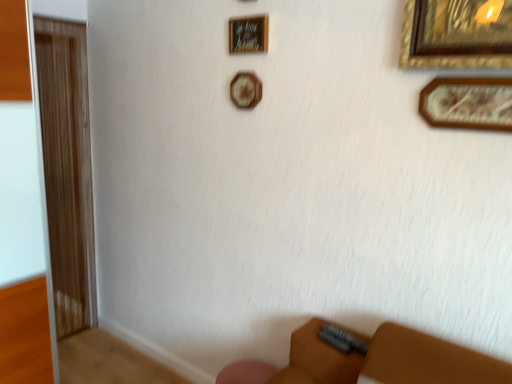
Measure the distance between wooden picture frame at upper center, arranged as the 2th picture frame when viewed from the top, and camera.

The depth of wooden picture frame at upper center, arranged as the 2th picture frame when viewed from the top, is 6.03 feet.

Describe the element at coordinates (67, 169) in the screenshot. The width and height of the screenshot is (512, 384). I see `brown wood screen door at left` at that location.

Describe the element at coordinates (248, 34) in the screenshot. I see `wooden plaque at upper center, which is the 2th picture frame in right-to-left order` at that location.

Locate an element on the screen. The height and width of the screenshot is (384, 512). wooden picture frame at upper right, acting as the 3th picture frame starting from the top is located at coordinates (468, 103).

Is wooden picture frame at upper center, which is counted as the second picture frame, starting from the bottom, wider or thinner than wooden plaque at upper center, which is the 2th picture frame in right-to-left order?

In the image, wooden picture frame at upper center, which is counted as the second picture frame, starting from the bottom, appears to be wider than wooden plaque at upper center, which is the 2th picture frame in right-to-left order.

Between wooden picture frame at upper center, which is the 3th picture frame from right to left, and wooden plaque at upper center, which is the 2th picture frame in right-to-left order, which one is positioned in front?

wooden plaque at upper center, which is the 2th picture frame in right-to-left order, is in front.

From the image's perspective, is wooden picture frame at upper center, which is counted as the first picture frame, starting from the left, beneath wooden plaque at upper center, the 2th picture frame in the back-to-front sequence?

Yes.

From a real-world perspective, which object stands above the other?

In real-world perspective, wooden plaque at upper center, the 2th picture frame in the back-to-front sequence, is above.

Is wooden picture frame at upper right, which is the third picture frame from back to front, turned away from wooden plaque at upper center, which is the 2th picture frame in right-to-left order?

wooden picture frame at upper right, which is the third picture frame from back to front, is not turned away from wooden plaque at upper center, which is the 2th picture frame in right-to-left order.

Is wooden picture frame at upper right, which is the third picture frame from back to front, completely or partially outside of wooden plaque at upper center, which appears as the 1th picture frame when viewed from the top?

Yes.

Is wooden picture frame at upper right, the 1th picture frame when ordered from right to left, to the right of wooden plaque at upper center, which is the 2th picture frame in right-to-left order, from the viewer's perspective?

Yes, wooden picture frame at upper right, the 1th picture frame when ordered from right to left, is to the right of wooden plaque at upper center, which is the 2th picture frame in right-to-left order.

Identify the location of picture frame that is the 2nd one below the wooden plaque at upper center, which appears as the 1th picture frame when viewed from the top (from a real-world perspective). (468, 103).

How many degrees apart are the facing directions of wooden picture frame at upper right, the 3th picture frame when ordered from left to right, and wooden picture frame at upper center, arranged as the 2th picture frame when viewed from the top?

wooden picture frame at upper right, the 3th picture frame when ordered from left to right, and wooden picture frame at upper center, arranged as the 2th picture frame when viewed from the top, are facing 0.642 degrees away from each other.

Can you confirm if wooden picture frame at upper right, which appears as the first picture frame when viewed from the front, is bigger than wooden picture frame at upper center, the first picture frame positioned from the back?

Correct, wooden picture frame at upper right, which appears as the first picture frame when viewed from the front, is larger in size than wooden picture frame at upper center, the first picture frame positioned from the back.

From the image's perspective, who appears lower, wooden picture frame at upper right, the 1th picture frame when ordered from right to left, or wooden picture frame at upper center, which is counted as the second picture frame, starting from the bottom?

From the image's view, wooden picture frame at upper right, the 1th picture frame when ordered from right to left, is below.

At what (x,y) coordinates should I click in order to perform the action: click on picture frame below the wooden picture frame at upper center, which is counted as the first picture frame, starting from the left (from the image's perspective). Please return your answer as a coordinate pair (x, y). Looking at the image, I should click on (468, 103).

Measure the distance from wooden plaque at upper center, which appears as the 1th picture frame when viewed from the top, to brown wood screen door at left.

4.64 feet.

Is wooden plaque at upper center, which is the 2th picture frame in right-to-left order, situated inside brown wood screen door at left or outside?

wooden plaque at upper center, which is the 2th picture frame in right-to-left order, is not enclosed by brown wood screen door at left.

From the image's perspective, between wooden plaque at upper center, arranged as the 3th picture frame when ordered from the bottom, and brown wood screen door at left, who is located below?

From the image's view, brown wood screen door at left is below.

Is wooden plaque at upper center, which is the 2th picture frame in front-to-back order, thinner than brown wood screen door at left?

Yes.

Is wooden picture frame at upper right, which appears as the first picture frame when viewed from the front, far from brown wood screen door at left?

Yes, wooden picture frame at upper right, which appears as the first picture frame when viewed from the front, and brown wood screen door at left are located far from each other.

From the image's perspective, which is below, wooden picture frame at upper right, the first picture frame from the bottom, or brown wood screen door at left?

From the image's view, brown wood screen door at left is below.

Is wooden picture frame at upper right, which appears as the first picture frame when viewed from the front, inside the boundaries of brown wood screen door at left, or outside?

wooden picture frame at upper right, which appears as the first picture frame when viewed from the front, lies outside brown wood screen door at left.

Can you confirm if wooden picture frame at upper right, the 3th picture frame when ordered from left to right, is thinner than brown wood screen door at left?

Indeed, wooden picture frame at upper right, the 3th picture frame when ordered from left to right, has a lesser width compared to brown wood screen door at left.

What are the coordinates of `the 2nd picture frame above when counting from the brown wood screen door at left (from the image's perspective)` in the screenshot? It's located at (245, 90).

Is wooden picture frame at upper center, which ranks as the 3th picture frame in front-to-back order, aimed at brown wood screen door at left?

No.

Between wooden picture frame at upper center, which is the 3th picture frame from right to left, and brown wood screen door at left, which one appears on the left side from the viewer's perspective?

brown wood screen door at left is more to the left.

Who is shorter, wooden picture frame at upper center, the first picture frame positioned from the back, or brown wood screen door at left?

wooden picture frame at upper center, the first picture frame positioned from the back.

Is wooden plaque at upper center, which is the 2th picture frame in front-to-back order, positioned far away from wooden picture frame at upper center, which is the 3th picture frame from right to left?

No, wooden plaque at upper center, which is the 2th picture frame in front-to-back order, is not far away from wooden picture frame at upper center, which is the 3th picture frame from right to left.

From a real-world perspective, is wooden plaque at upper center, arranged as the 3th picture frame when ordered from the bottom, positioned over wooden picture frame at upper center, the first picture frame positioned from the back, based on gravity?

Correct, in the physical world, wooden plaque at upper center, arranged as the 3th picture frame when ordered from the bottom, is higher than wooden picture frame at upper center, the first picture frame positioned from the back.

Measure the distance between wooden plaque at upper center, which appears as the 1th picture frame when viewed from the top, and wooden picture frame at upper center, which ranks as the 3th picture frame in front-to-back order.

wooden plaque at upper center, which appears as the 1th picture frame when viewed from the top, and wooden picture frame at upper center, which ranks as the 3th picture frame in front-to-back order, are 6.59 inches apart.

Image resolution: width=512 pixels, height=384 pixels. Identify the location of the 1st picture frame in front when counting from the wooden picture frame at upper center, which is the 3th picture frame from right to left. (248, 34).

Locate an element on the screen. picture frame that is the 1st object located behind the wooden picture frame at upper right, the 3th picture frame when ordered from left to right is located at coordinates (248, 34).

From the image, which object appears to be farther from wooden picture frame at upper right, the 1th picture frame when ordered from right to left, wooden plaque at upper center, the 2th picture frame in the back-to-front sequence, or brown wood screen door at left?

The object further to wooden picture frame at upper right, the 1th picture frame when ordered from right to left, is brown wood screen door at left.

Estimate the real-world distances between objects in this image. Which object is closer to wooden picture frame at upper right, which is the third picture frame from back to front, brown wood screen door at left or wooden plaque at upper center, arranged as the 3th picture frame when ordered from the bottom?

Among the two, wooden plaque at upper center, arranged as the 3th picture frame when ordered from the bottom, is located nearer to wooden picture frame at upper right, which is the third picture frame from back to front.

Looking at the image, which one is located closer to wooden picture frame at upper center, the first picture frame positioned from the back, brown wood screen door at left or wooden plaque at upper center, which is the 2th picture frame in right-to-left order?

wooden plaque at upper center, which is the 2th picture frame in right-to-left order, is positioned closer to the anchor wooden picture frame at upper center, the first picture frame positioned from the back.

Based on the photo, looking at the image, which one is located further to wooden plaque at upper center, placed as the second picture frame when sorted from left to right, brown wood screen door at left or wooden picture frame at upper center, the first picture frame positioned from the back?

Based on the image, brown wood screen door at left appears to be further to wooden plaque at upper center, placed as the second picture frame when sorted from left to right.

When comparing their distances from brown wood screen door at left, does wooden picture frame at upper right, the 1th picture frame when ordered from right to left, or wooden picture frame at upper center, the first picture frame positioned from the back, seem closer?

wooden picture frame at upper center, the first picture frame positioned from the back, is closer to brown wood screen door at left.

Looking at this image, looking at the image, which one is located further to brown wood screen door at left, wooden picture frame at upper right, the 1th picture frame when ordered from right to left, or wooden plaque at upper center, placed as the second picture frame when sorted from left to right?

wooden picture frame at upper right, the 1th picture frame when ordered from right to left, lies further to brown wood screen door at left than the other object.

When comparing their distances from wooden picture frame at upper right, the 3th picture frame when ordered from left to right, does wooden picture frame at upper center, which is the 3th picture frame from right to left, or brown wood screen door at left seem closer?

wooden picture frame at upper center, which is the 3th picture frame from right to left.

Estimate the real-world distances between objects in this image. Which object is closer to wooden plaque at upper center, the 2th picture frame in the back-to-front sequence, wooden picture frame at upper center, arranged as the 2th picture frame when viewed from the top, or wooden picture frame at upper right, acting as the 3th picture frame starting from the top?

wooden picture frame at upper center, arranged as the 2th picture frame when viewed from the top.

Where is `picture frame between wooden picture frame at upper center, arranged as the 2th picture frame when viewed from the top, and wooden picture frame at upper right, the first picture frame from the bottom, from left to right`? The height and width of the screenshot is (384, 512). picture frame between wooden picture frame at upper center, arranged as the 2th picture frame when viewed from the top, and wooden picture frame at upper right, the first picture frame from the bottom, from left to right is located at coordinates (248, 34).

At what (x,y) coordinates should I click in order to perform the action: click on picture frame situated between brown wood screen door at left and wooden plaque at upper center, which is the 2th picture frame in front-to-back order, from left to right. Please return your answer as a coordinate pair (x, y). This screenshot has height=384, width=512. Looking at the image, I should click on (245, 90).